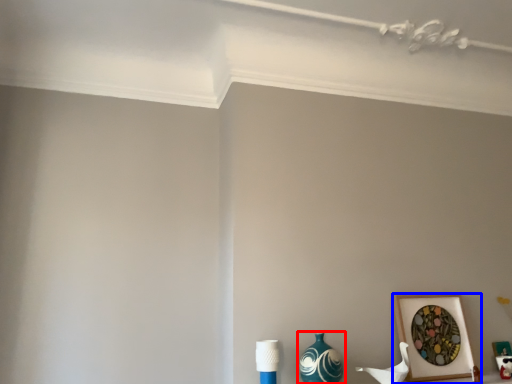
Question: Among these objects, which one is farthest to the camera, vase (highlighted by a red box) or picture frame (highlighted by a blue box)?

Choices:
 (A) vase
 (B) picture frame

Answer: (B)